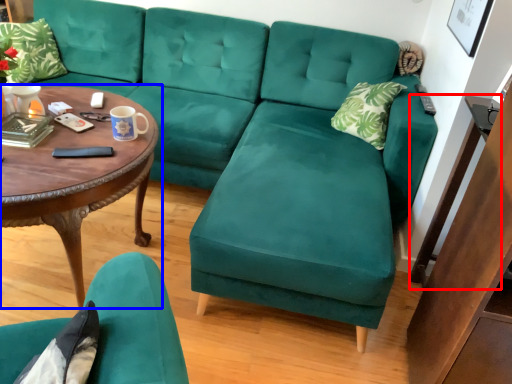
Question: Which object is closer to the camera taking this photo, side table (highlighted by a red box) or coffee table (highlighted by a blue box)?

Choices:
 (A) side table
 (B) coffee table

Answer: (B)